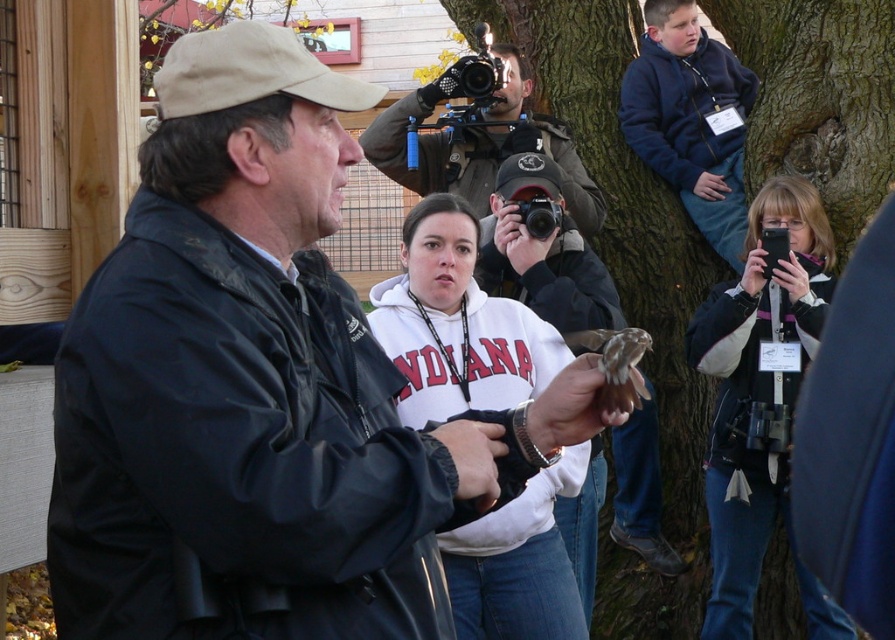
You are a photographer standing at the camera position. You want to take a photo of the white fleece sweatshirt at center without moving the camera. Is it possible to capture the entire sweatshirt in the frame?

The white fleece sweatshirt at center and camera are 17.47 feet apart from each other. Since the distance is relatively large, it might be challenging to capture the entire sweatshirt in the frame without moving the camera. However, using a wide angle lens could help include the entire subject in the shot.